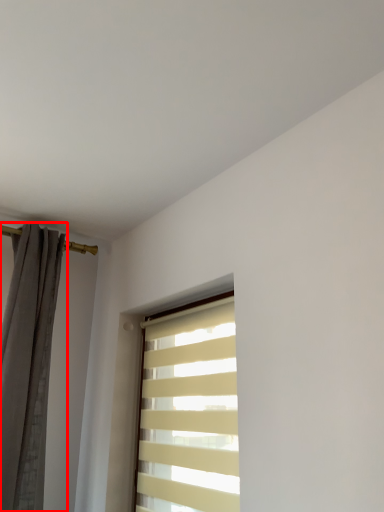
Question: Considering the relative positions of curtain (annotated by the red box) and window in the image provided, where is curtain (annotated by the red box) located with respect to the staircase?

Choices:
 (A) right
 (B) left

Answer: (B)